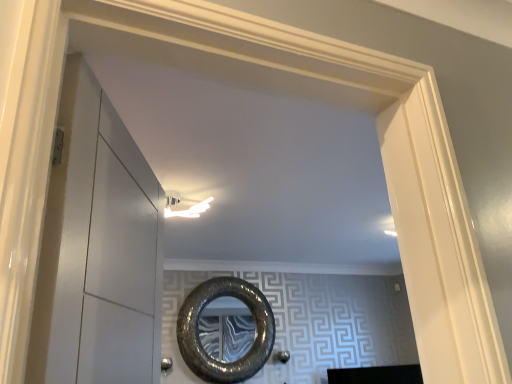
Question: Is shiny metallic mirror at center positioned in front of polished silver door handle at lower center?

Choices:
 (A) yes
 (B) no

Answer: (B)

Question: From a real-world perspective, is shiny metallic mirror at center under polished silver door handle at lower center?

Choices:
 (A) yes
 (B) no

Answer: (B)

Question: Is shiny metallic mirror at center shorter than polished silver door handle at lower center?

Choices:
 (A) yes
 (B) no

Answer: (B)

Question: Does shiny metallic mirror at center have a larger size compared to polished silver door handle at lower center?

Choices:
 (A) yes
 (B) no

Answer: (A)

Question: Can you confirm if shiny metallic mirror at center is wider than polished silver door handle at lower center?

Choices:
 (A) no
 (B) yes

Answer: (B)

Question: From the image's perspective, is shiny metallic mirror at center located above polished silver door handle at lower center?

Choices:
 (A) yes
 (B) no

Answer: (A)

Question: Considering the relative sizes of shiny metallic mirror at center and transparent glass door at left in the image provided, is shiny metallic mirror at center thinner than transparent glass door at left?

Choices:
 (A) no
 (B) yes

Answer: (B)

Question: Can you confirm if shiny metallic mirror at center is taller than transparent glass door at left?

Choices:
 (A) yes
 (B) no

Answer: (A)

Question: Does shiny metallic mirror at center have a smaller size compared to transparent glass door at left?

Choices:
 (A) yes
 (B) no

Answer: (B)

Question: Is shiny metallic mirror at center positioned before transparent glass door at left?

Choices:
 (A) no
 (B) yes

Answer: (A)

Question: From a real-world perspective, is shiny metallic mirror at center located higher than transparent glass door at left?

Choices:
 (A) no
 (B) yes

Answer: (B)

Question: Would you say shiny metallic mirror at center contains transparent glass door at left?

Choices:
 (A) no
 (B) yes

Answer: (A)

Question: From the image's perspective, does polished silver door handle at lower center appear higher than transparent glass door at left?

Choices:
 (A) yes
 (B) no

Answer: (B)